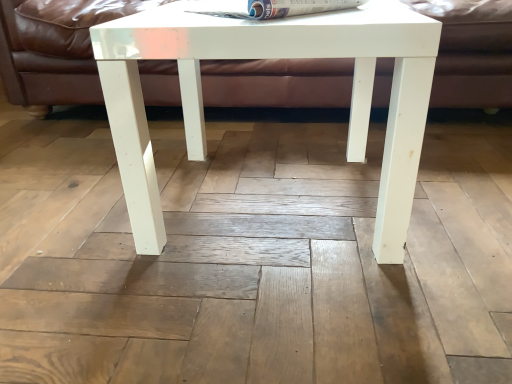
The width and height of the screenshot is (512, 384). What are the coordinates of `free location in front of white glossy table at center` in the screenshot? It's located at (266, 310).